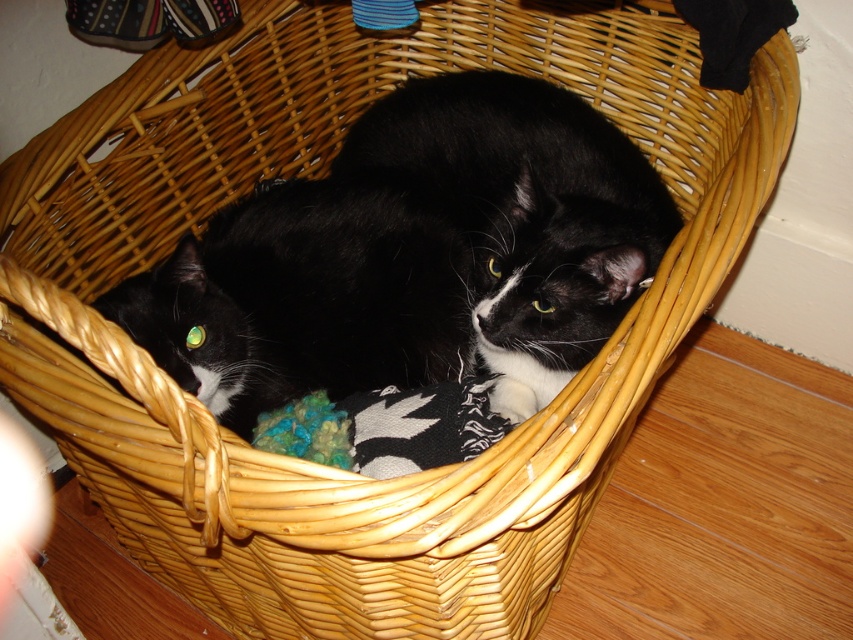
Question: Is the position of black fur cat at center more distant than that of multicolored yarn ball at center?

Choices:
 (A) no
 (B) yes

Answer: (A)

Question: Among these objects, which one is nearest to the camera?

Choices:
 (A) black fur cat at center
 (B) multicolored yarn ball at center

Answer: (A)

Question: In this image, where is black fur cat at center located relative to multicolored yarn ball at center?

Choices:
 (A) left
 (B) right

Answer: (B)

Question: Is black fur cat at center smaller than multicolored yarn ball at center?

Choices:
 (A) yes
 (B) no

Answer: (B)

Question: Which point is closer to the camera?

Choices:
 (A) (447, 113)
 (B) (285, 454)

Answer: (B)